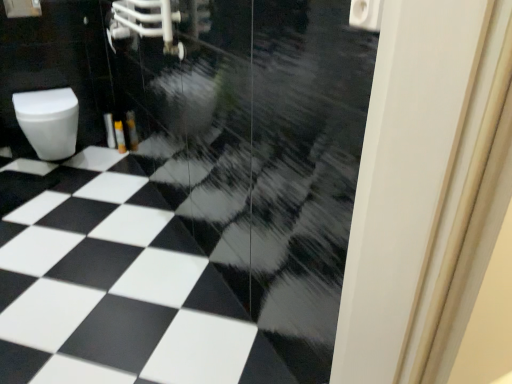
Question: Is white glossy toilet at left with black glossy tile at center?

Choices:
 (A) no
 (B) yes

Answer: (A)

Question: Is white glossy toilet at left thinner than black glossy tile at center?

Choices:
 (A) no
 (B) yes

Answer: (B)

Question: Can you confirm if white glossy toilet at left is smaller than black glossy tile at center?

Choices:
 (A) yes
 (B) no

Answer: (A)

Question: From the image's perspective, is white glossy toilet at left beneath black glossy tile at center?

Choices:
 (A) no
 (B) yes

Answer: (A)

Question: Is white glossy toilet at left at the right side of black glossy tile at center?

Choices:
 (A) yes
 (B) no

Answer: (B)

Question: Is white glossy toilet paper at upper right taller or shorter than white glossy door at right?

Choices:
 (A) tall
 (B) short

Answer: (B)

Question: Is white glossy toilet paper at upper right in front of or behind white glossy door at right in the image?

Choices:
 (A) behind
 (B) front

Answer: (A)

Question: In terms of size, does white glossy toilet paper at upper right appear bigger or smaller than white glossy door at right?

Choices:
 (A) big
 (B) small

Answer: (B)

Question: Considering the positions of point (374, 31) and point (408, 61), is point (374, 31) closer or farther from the camera than point (408, 61)?

Choices:
 (A) farther
 (B) closer

Answer: (A)

Question: Is white glossy toilet paper at upper right to the left or to the right of black glossy tile at center in the image?

Choices:
 (A) right
 (B) left

Answer: (A)

Question: Considering the positions of white glossy toilet paper at upper right and black glossy tile at center in the image, is white glossy toilet paper at upper right wider or thinner than black glossy tile at center?

Choices:
 (A) wide
 (B) thin

Answer: (B)

Question: Based on their sizes in the image, would you say white glossy toilet paper at upper right is bigger or smaller than black glossy tile at center?

Choices:
 (A) small
 (B) big

Answer: (A)

Question: Is white glossy toilet paper at upper right inside or outside of black glossy tile at center?

Choices:
 (A) inside
 (B) outside

Answer: (B)

Question: From a real-world perspective, is black glossy tile at center positioned above or below white glossy toilet paper at upper right?

Choices:
 (A) below
 (B) above

Answer: (A)

Question: From their relative heights in the image, would you say black glossy tile at center is taller or shorter than white glossy toilet paper at upper right?

Choices:
 (A) short
 (B) tall

Answer: (A)